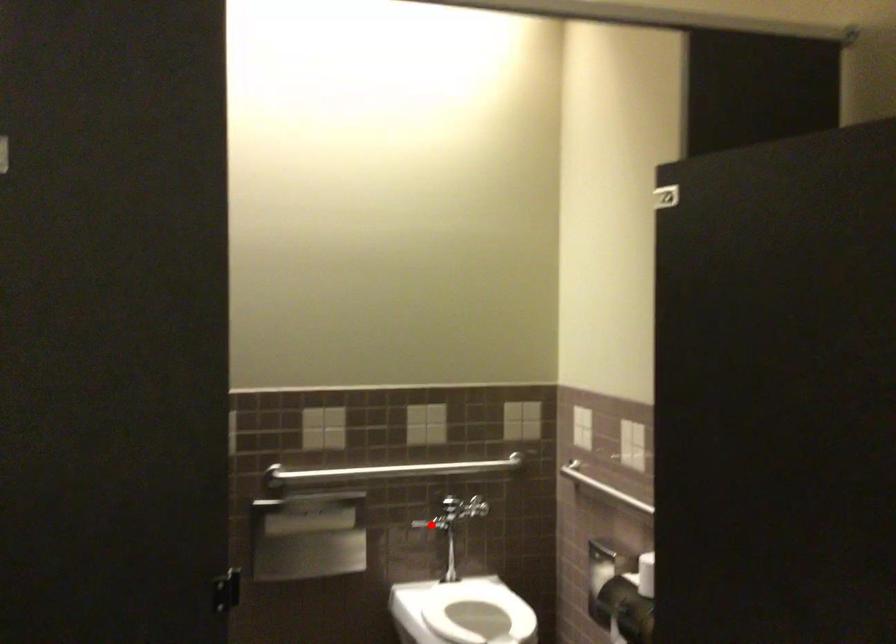
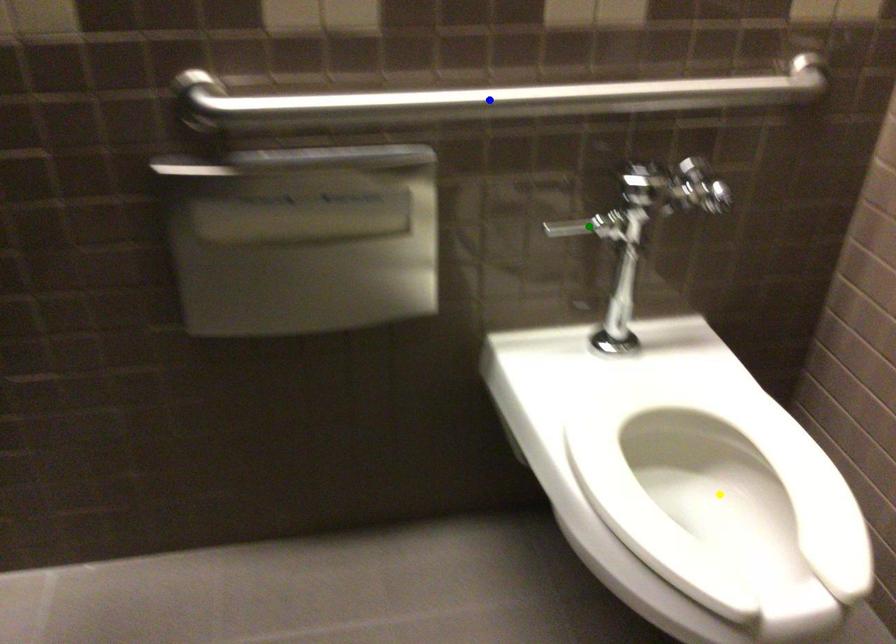
Question: I am providing you with two images of the same scene from different viewpoints. A red point is marked on the first image. You are given multiple points on the second image. In image 2, which mark is for the same physical point as the one in image 1?

Choices:
 (A) yellow point
 (B) green point
 (C) blue point

Answer: (B)